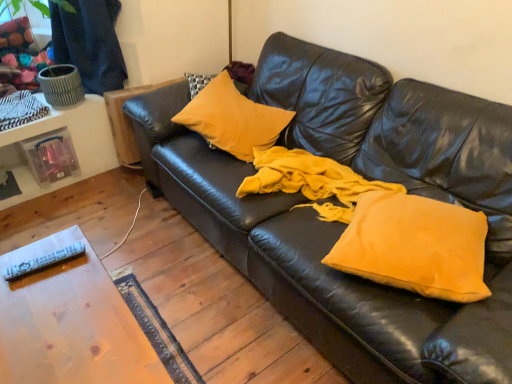
The width and height of the screenshot is (512, 384). Find the location of `wooden table at lower left`. wooden table at lower left is located at coordinates (70, 323).

What do you see at coordinates (233, 119) in the screenshot?
I see `matte yellow pillow at center, the 1th pillow positioned from the top` at bounding box center [233, 119].

Where is `matte yellow pillow at center, acting as the second pillow starting from the back`? The width and height of the screenshot is (512, 384). matte yellow pillow at center, acting as the second pillow starting from the back is located at coordinates (x=415, y=246).

Which is behind, point (238, 141) or point (448, 291)?

The point (238, 141) is more distant.

Between matte yellow pillow at center, the second pillow from the right, and matte yellow pillow at center, marked as the first pillow in a bottom-to-top arrangement, which one is positioned in front?

matte yellow pillow at center, marked as the first pillow in a bottom-to-top arrangement, is closer to the camera.

Who is smaller, matte yellow pillow at center, the second pillow from the right, or matte yellow pillow at center, which is counted as the 1th pillow, starting from the front?

→ With smaller size is matte yellow pillow at center, which is counted as the 1th pillow, starting from the front.

From a real-world perspective, between white plastic remote at lower left and wooden table at lower left, who is vertically higher?

white plastic remote at lower left, from a real-world perspective.

Is white plastic remote at lower left positioned before wooden table at lower left?

No, white plastic remote at lower left is behind wooden table at lower left.

Is white plastic remote at lower left located outside wooden table at lower left?

white plastic remote at lower left is positioned outside wooden table at lower left.

Which object is positioned more to the left, white plastic remote at lower left or wooden table at lower left?

From the viewer's perspective, white plastic remote at lower left appears more on the left side.

You are a GUI agent. You are given a task and a screenshot of the screen. Output one action in this format:
    pyautogui.click(x=<x>, y=<y>)
    Task: Click on the pillow below the matte yellow pillow at center, placed as the 2th pillow when sorted from bottom to top (from a real-world perspective)
    
    Given the screenshot: What is the action you would take?
    pyautogui.click(x=415, y=246)

Is matte yellow pillow at center, positioned as the first pillow in right-to-left order, facing away from matte yellow pillow at center, the second pillow from the right?

No, matte yellow pillow at center, positioned as the first pillow in right-to-left order,'s orientation is not away from matte yellow pillow at center, the second pillow from the right.

From a real-world perspective, does matte yellow pillow at center, the 2th pillow from the top, stand above matte yellow pillow at center, placed as the 2th pillow when sorted from bottom to top?

Actually, matte yellow pillow at center, the 2th pillow from the top, is physically below matte yellow pillow at center, placed as the 2th pillow when sorted from bottom to top, in the real world.

Which object is closer to the camera, wooden table at lower left or matte yellow pillow at center, which appears as the first pillow when viewed from the back?

wooden table at lower left is closer to the camera.

From a real-world perspective, who is located lower, wooden table at lower left or matte yellow pillow at center, which appears as the first pillow when viewed from the back?

wooden table at lower left, from a real-world perspective.

Is wooden table at lower left to the left or to the right of matte yellow pillow at center, placed as the first pillow when sorted from left to right, in the image?

wooden table at lower left is positioned on matte yellow pillow at center, placed as the first pillow when sorted from left to right,'s left side.

Does point (129, 368) come farther from viewer compared to point (243, 97)?

No.

Would you say matte yellow pillow at center, the second pillow from the right, is inside or outside white plastic remote at lower left?

matte yellow pillow at center, the second pillow from the right, lies outside white plastic remote at lower left.

From a real-world perspective, is matte yellow pillow at center, the 1th pillow positioned from the top, physically located above or below white plastic remote at lower left?

From a real-world perspective, matte yellow pillow at center, the 1th pillow positioned from the top, is physically below white plastic remote at lower left.

Are matte yellow pillow at center, placed as the second pillow when sorted from front to back, and white plastic remote at lower left far apart?

Yes, matte yellow pillow at center, placed as the second pillow when sorted from front to back, is far from white plastic remote at lower left.

The width and height of the screenshot is (512, 384). In order to click on table located in front of the matte yellow pillow at center, the second pillow from the right in this screenshot , I will do `click(70, 323)`.

Does matte yellow pillow at center, the second pillow from the right, have a lesser width compared to wooden table at lower left?

Correct, the width of matte yellow pillow at center, the second pillow from the right, is less than that of wooden table at lower left.

Would you consider matte yellow pillow at center, which appears as the first pillow when viewed from the back, to be distant from wooden table at lower left?

That's right, there is a large distance between matte yellow pillow at center, which appears as the first pillow when viewed from the back, and wooden table at lower left.

Which object is positioned more to the left, matte yellow pillow at center, placed as the 2th pillow when sorted from bottom to top, or wooden table at lower left?

From the viewer's perspective, wooden table at lower left appears more on the left side.

This screenshot has height=384, width=512. In order to click on table located in front of the white plastic remote at lower left in this screenshot , I will do `click(70, 323)`.

Considering their positions, is wooden table at lower left located in front of or behind white plastic remote at lower left?

wooden table at lower left is positioned closer to the viewer than white plastic remote at lower left.

Is point (136, 366) positioned behind point (82, 243)?

No.

Can you tell me how much wooden table at lower left and white plastic remote at lower left differ in facing direction?

The angle between the facing direction of wooden table at lower left and the facing direction of white plastic remote at lower left is 82.8 degrees.

This screenshot has height=384, width=512. Find the location of `pillow in front of the matte yellow pillow at center, the second pillow from the right`. pillow in front of the matte yellow pillow at center, the second pillow from the right is located at coordinates (415, 246).

Identify the location of table to the right of white plastic remote at lower left. This screenshot has height=384, width=512. (70, 323).

Looking at the image, which one is located further to matte yellow pillow at center, marked as the first pillow in a bottom-to-top arrangement, white plastic remote at lower left or matte yellow pillow at center, placed as the 2th pillow when sorted from bottom to top?

white plastic remote at lower left.

Which object lies further to the anchor point matte yellow pillow at center, placed as the first pillow when sorted from left to right, wooden table at lower left or white plastic remote at lower left?

white plastic remote at lower left is further to matte yellow pillow at center, placed as the first pillow when sorted from left to right.

From the image, which object appears to be farther from matte yellow pillow at center, the 1th pillow positioned from the top, white plastic remote at lower left or wooden table at lower left?

white plastic remote at lower left.

When comparing their distances from matte yellow pillow at center, acting as the second pillow starting from the left, does wooden table at lower left or white plastic remote at lower left seem closer?

Based on the image, wooden table at lower left appears to be nearer to matte yellow pillow at center, acting as the second pillow starting from the left.

Based on their spatial positions, is matte yellow pillow at center, the second pillow from the right, or wooden table at lower left closer to white plastic remote at lower left?

The object closer to white plastic remote at lower left is wooden table at lower left.

When comparing their distances from white plastic remote at lower left, does wooden table at lower left or matte yellow pillow at center, which is counted as the 1th pillow, starting from the front, seem closer?

wooden table at lower left.

Considering their positions, is matte yellow pillow at center, which is counted as the 1th pillow, starting from the front, positioned further to white plastic remote at lower left than wooden table at lower left?

matte yellow pillow at center, which is counted as the 1th pillow, starting from the front, lies further to white plastic remote at lower left than the other object.

Based on their spatial positions, is matte yellow pillow at center, placed as the second pillow when sorted from front to back, or white plastic remote at lower left further from wooden table at lower left?

Among the two, matte yellow pillow at center, placed as the second pillow when sorted from front to back, is located further to wooden table at lower left.

Locate an element on the screen. This screenshot has height=384, width=512. table located between white plastic remote at lower left and matte yellow pillow at center, positioned as the first pillow in right-to-left order, in the left-right direction is located at coordinates (70, 323).

Find the location of `pillow between white plastic remote at lower left and matte yellow pillow at center, the 2th pillow from the top, in the horizontal direction`. pillow between white plastic remote at lower left and matte yellow pillow at center, the 2th pillow from the top, in the horizontal direction is located at coordinates (233, 119).

The width and height of the screenshot is (512, 384). I want to click on pillow between wooden table at lower left and matte yellow pillow at center, which is counted as the 1th pillow, starting from the front, in the horizontal direction, so click(233, 119).

Image resolution: width=512 pixels, height=384 pixels. What are the coordinates of `remote between wooden table at lower left and matte yellow pillow at center, placed as the first pillow when sorted from left to right, in the front-back direction` in the screenshot? It's located at (42, 262).